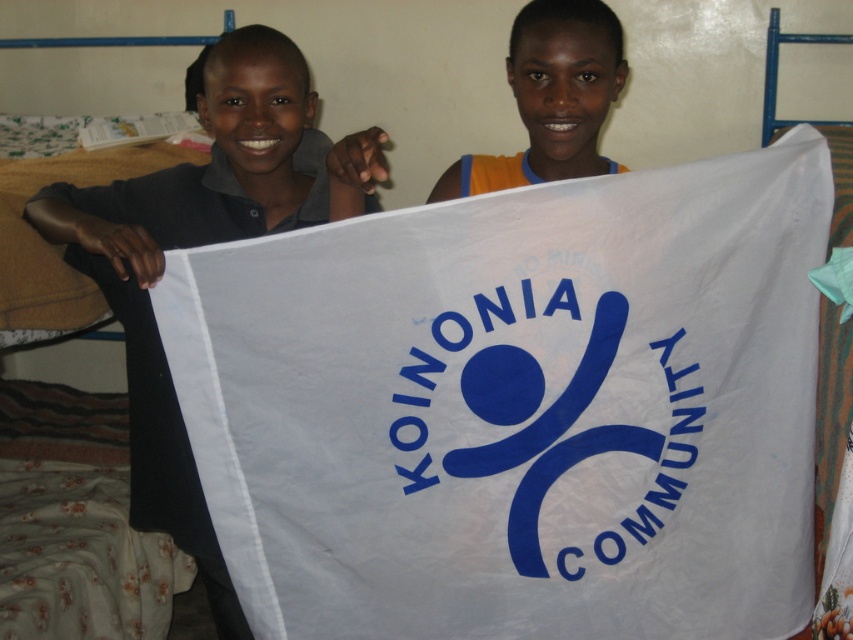
Question: Can you confirm if white fabric flag at center is wider than blue fabric logo at center?

Choices:
 (A) no
 (B) yes

Answer: (B)

Question: Can you confirm if white fabric flag at center is positioned to the left of dark gray shirt at left?

Choices:
 (A) no
 (B) yes

Answer: (A)

Question: Which object is the farthest from the white fabric flag at center?

Choices:
 (A) blue fabric logo at center
 (B) dark gray shirt at left
 (C) orange fabric at upper center

Answer: (C)

Question: Which of the following is the closest to the observer?

Choices:
 (A) dark gray shirt at left
 (B) blue fabric logo at center
 (C) orange fabric at upper center

Answer: (A)

Question: Based on their relative distances, which object is farther from the orange fabric at upper center?

Choices:
 (A) white fabric flag at center
 (B) dark gray shirt at left

Answer: (A)

Question: Does white fabric flag at center lie in front of blue fabric logo at center?

Choices:
 (A) yes
 (B) no

Answer: (A)